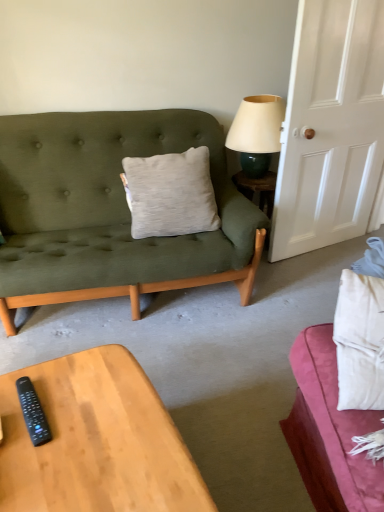
Question: Is white matte door at right inside or outside of matte green glass lamp at upper right?

Choices:
 (A) outside
 (B) inside

Answer: (A)

Question: From the image's perspective, is white matte door at right above or below matte green glass lamp at upper right?

Choices:
 (A) below
 (B) above

Answer: (A)

Question: Which object is positioned closest to the white matte door at right?

Choices:
 (A) wooden coffee table at lower left
 (B) black plastic remote at lower left
 (C) white fabric studio couch at lower right
 (D) light gray cotton pillow at center
 (E) matte green glass lamp at upper right

Answer: (E)

Question: Which object is positioned closest to the black plastic remote at lower left?

Choices:
 (A) matte green glass lamp at upper right
 (B) wooden coffee table at lower left
 (C) white matte door at right
 (D) white fabric studio couch at lower right
 (E) light gray cotton pillow at center

Answer: (B)